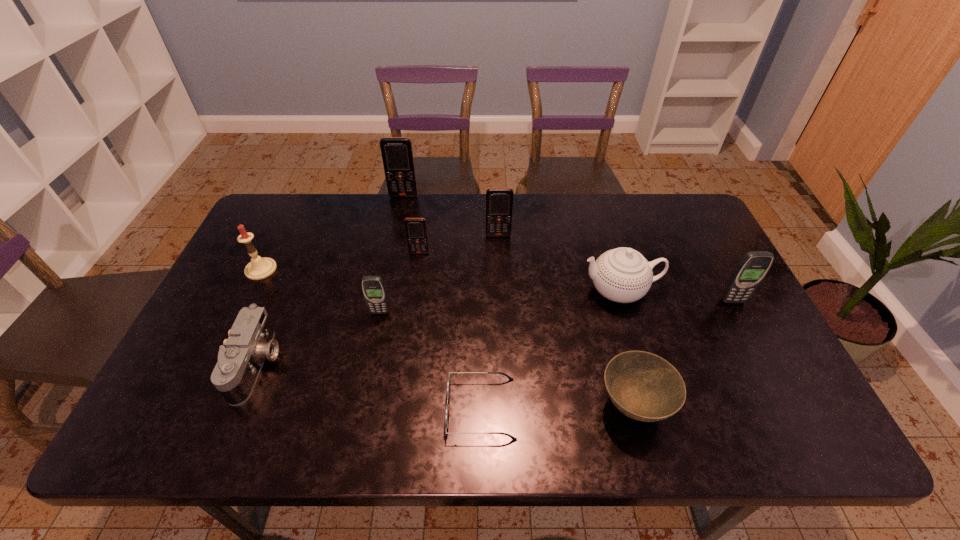
At what (x,y) coordinates should I click in order to perform the action: click on the farthest cellular telephone. Please return your answer as a coordinate pair (x, y). Looking at the image, I should click on (397, 155).

This screenshot has width=960, height=540. In order to click on the biggest orange cellular telephone in this screenshot , I will do `click(397, 155)`.

The image size is (960, 540). I want to click on the rightmost object, so pyautogui.click(x=753, y=267).

I want to click on the rightmost cellular telephone, so click(x=753, y=267).

You are a GUI agent. You are given a task and a screenshot of the screen. Output one action in this format:
    pyautogui.click(x=<x>, y=<y>)
    Task: Click on the rightmost orange cellular telephone
    
    Given the screenshot: What is the action you would take?
    pyautogui.click(x=499, y=201)

What are the coordinates of `the fourth cellular telephone from left to right` in the screenshot? It's located at (499, 201).

Identify the location of the leftmost object. The image size is (960, 540). pos(259,268).

Find the location of `red candle`. red candle is located at coordinates (259, 268).

Locate an element on the screen. This screenshot has height=540, width=960. chinaware is located at coordinates (623, 275).

Image resolution: width=960 pixels, height=540 pixels. What are the coordinates of `the third farthest cellular telephone` in the screenshot? It's located at (416, 232).